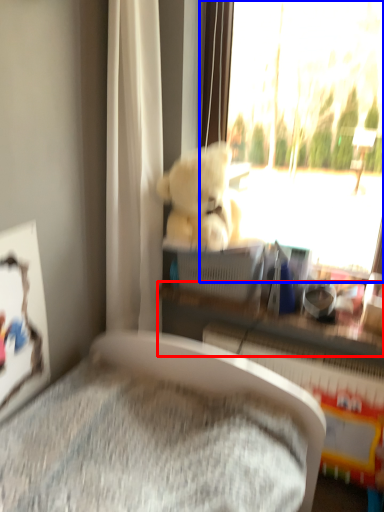
Question: Which of the following is the closest to the observer, shelf (highlighted by a red box) or window (highlighted by a blue box)?

Choices:
 (A) shelf
 (B) window

Answer: (B)